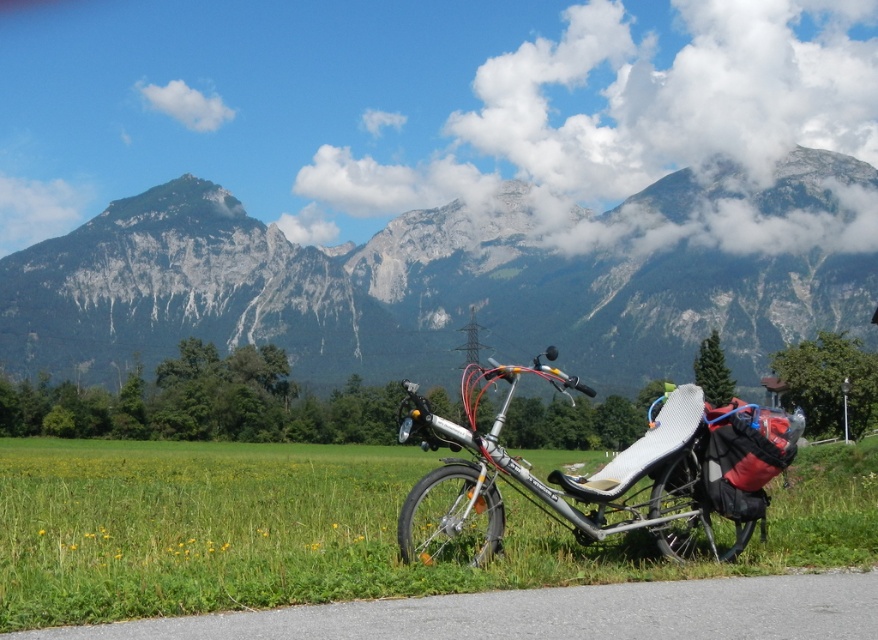
Which is behind, point (565, 310) or point (738, 460)?

Positioned behind is point (565, 310).

Does rugged stone mountain at upper center appear under silver metallic reclining bicycle at center?

No, rugged stone mountain at upper center is not below silver metallic reclining bicycle at center.

Find the location of a particular element. rugged stone mountain at upper center is located at coordinates [402, 292].

Can you confirm if green grass at lower center is taller than silver metallic reclining bicycle at center?

Correct, green grass at lower center is much taller as silver metallic reclining bicycle at center.

Is green grass at lower center wider than silver metallic reclining bicycle at center?

Yes.

This screenshot has height=640, width=878. In order to click on green grass at lower center in this screenshot , I will do click(x=329, y=529).

Which is more to the left, rugged stone mountain at upper center or green grass at lower center?

green grass at lower center is more to the left.

Who is more forward, (286, 337) or (407, 452)?

Positioned in front is point (407, 452).

Which is in front, point (180, 336) or point (256, 508)?

Point (256, 508)

Locate an element on the screen. The height and width of the screenshot is (640, 878). rugged stone mountain at upper center is located at coordinates (402, 292).